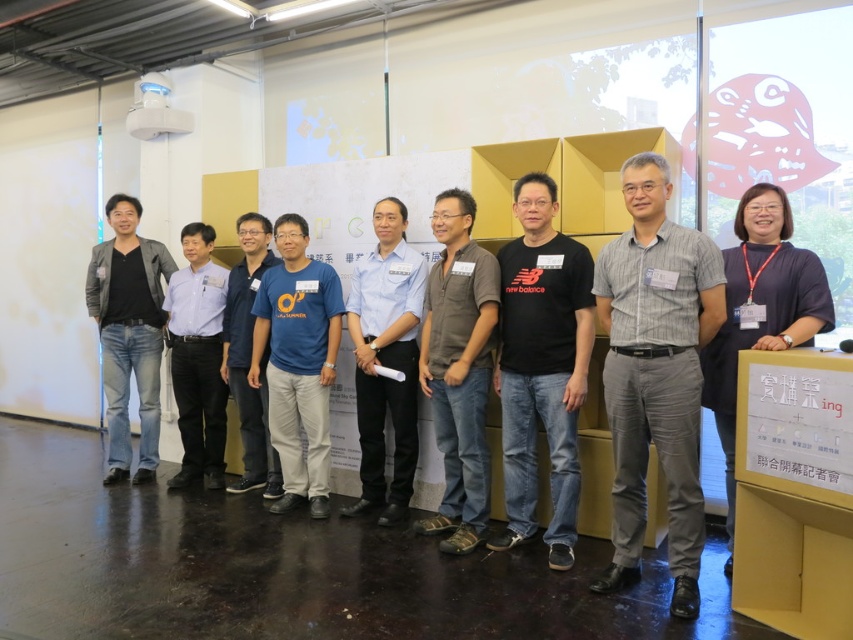
Is brown cotton shirt at center to the left of purple fabric shirt at right from the viewer's perspective?

Correct, you'll find brown cotton shirt at center to the left of purple fabric shirt at right.

Which is below, brown cotton shirt at center or purple fabric shirt at right?

Positioned lower is purple fabric shirt at right.

Find the location of a particular element. This screenshot has height=640, width=853. brown cotton shirt at center is located at coordinates (457, 369).

Find the location of a particular element. Image resolution: width=853 pixels, height=640 pixels. brown cotton shirt at center is located at coordinates (457, 369).

Based on the photo, is purple fabric shirt at right smaller than blue t-shirt at center?

No.

Can you confirm if purple fabric shirt at right is bigger than blue t-shirt at center?

Correct, purple fabric shirt at right is larger in size than blue t-shirt at center.

Is point (787, 273) less distant than point (248, 323)?

Yes, it is.

What are the coordinates of `purple fabric shirt at right` in the screenshot? It's located at (759, 310).

Based on the photo, between blue uniform shirt at center and purple fabric shirt at right, which one appears on the left side from the viewer's perspective?

blue uniform shirt at center is more to the left.

Between blue uniform shirt at center and purple fabric shirt at right, which one is positioned higher?

blue uniform shirt at center is higher up.

Does point (376, 266) come behind point (747, 262)?

Yes.

This screenshot has height=640, width=853. Identify the location of blue uniform shirt at center. (386, 360).